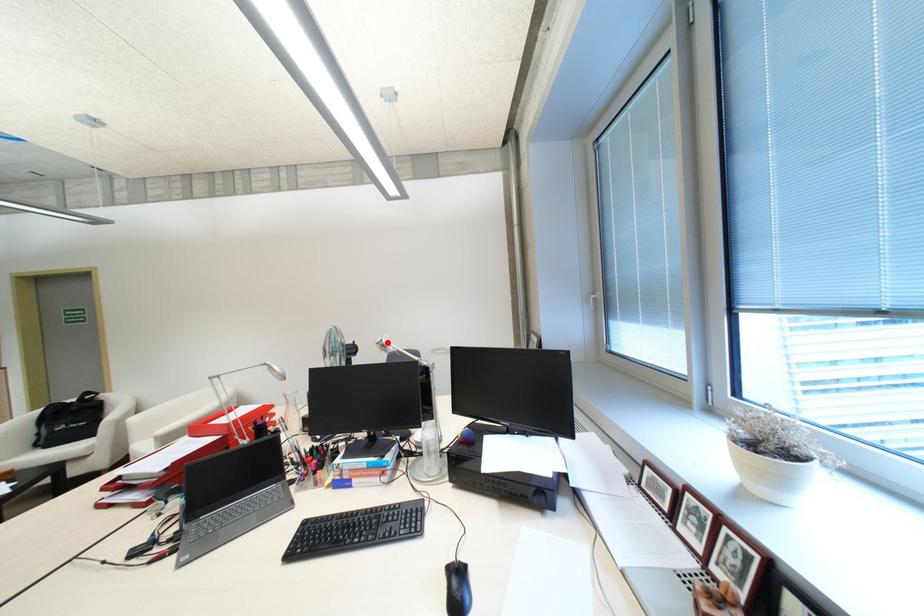
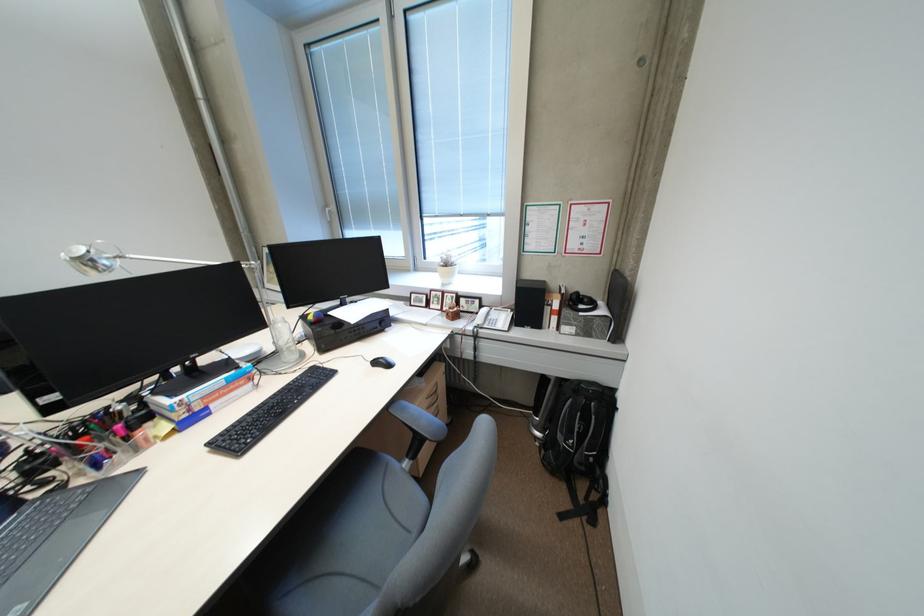
In the second image, find the point that corresponds to the highlighted location in the first image.

(90, 257)